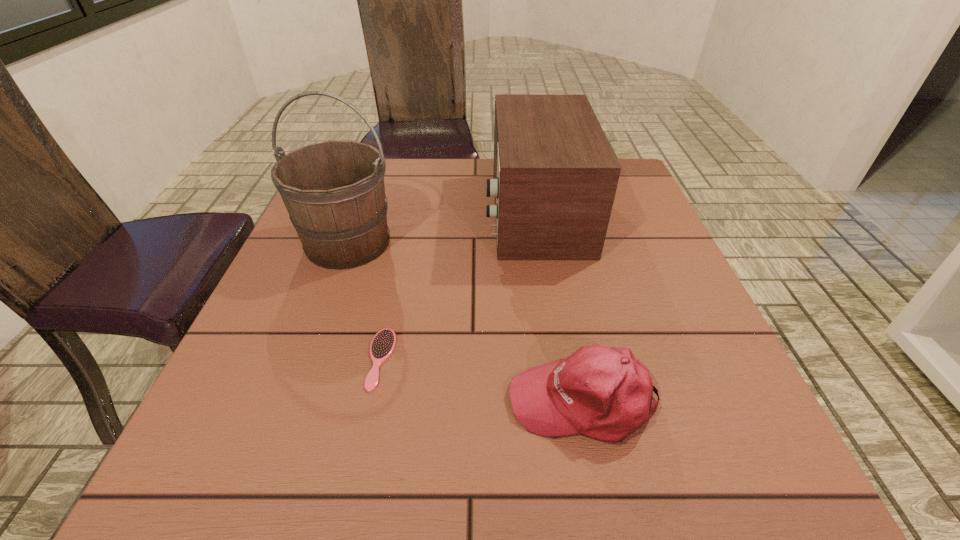
You are a GUI agent. You are given a task and a screenshot of the screen. Output one action in this format:
    pyautogui.click(x=<x>, y=<y>)
    Task: Click on the free region located at the front of the baseball cap with the brim
    
    Given the screenshot: What is the action you would take?
    pyautogui.click(x=471, y=402)

In order to click on free spot located on the left of the hairbrush in this screenshot , I will do `click(231, 359)`.

Locate an element on the screen. This screenshot has height=540, width=960. object located at the far edge is located at coordinates [555, 174].

Locate an element on the screen. The image size is (960, 540). object that is at the near edge is located at coordinates (604, 393).

Find the location of a particular element. The image size is (960, 540). object present at the left edge is located at coordinates (334, 192).

Identify the location of object at the right edge. (604, 393).

Identify the location of object located in the near right corner section of the desktop. The image size is (960, 540). (604, 393).

Identify the location of free region at the far edge of the desktop. (400, 158).

This screenshot has width=960, height=540. Identify the location of vacant region at the near edge of the desktop. (335, 449).

Locate an element on the screen. The width and height of the screenshot is (960, 540). vacant space at the left edge of the desktop is located at coordinates (314, 315).